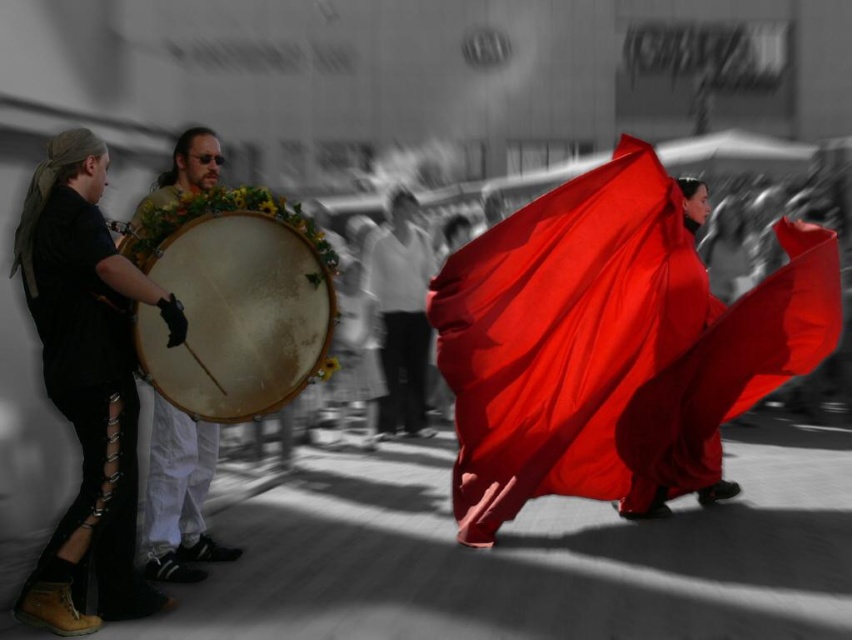
You are a photographer standing at the center of the scene. You want to take a photo of the wooden drum at center and the smooth white shirt at center. How far apart are these two objects in meters?

The wooden drum at center is 4.04 meters away from the smooth white shirt at center.

You are standing at the origin point of the coordinate system in the image. There is a wooden drum at center located at point (237,316). Can you walk straight ahead from your current position to reach the wooden drum at center without deviating left or right?

The wooden drum at center is located at point (237,316), so if you walk straight ahead from the origin point along the central axis, you will reach the wooden drum at center directly without needing to adjust your path.

You are standing in the middle of the street and see two points in the scene. Which point is closer to you? The points are point (645, 368) and point (106, 480).

Point (645, 368) is further to the viewer than point (106, 480), so the closer point to you is point (106, 480).